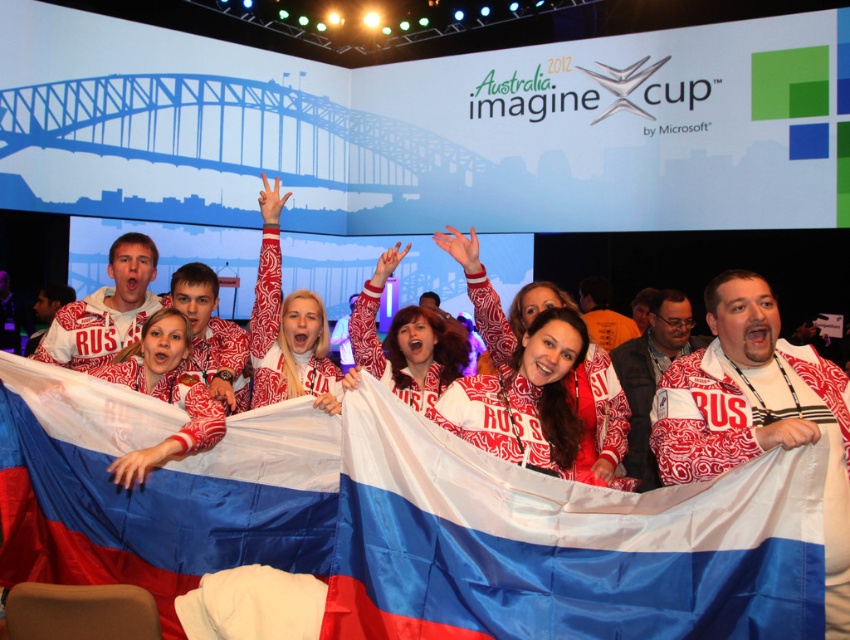
Question: Is russian flag at center to the left of white matte jacket at center from the viewer's perspective?

Choices:
 (A) yes
 (B) no

Answer: (A)

Question: Which point is farther from the camera taking this photo?

Choices:
 (A) (301, 385)
 (B) (145, 412)
 (C) (666, 541)
 (D) (794, 388)

Answer: (A)

Question: Is polyester flag at center below white textured jacket at center?

Choices:
 (A) no
 (B) yes

Answer: (B)

Question: Does white matte jacket at center appear on the right side of white printed sweater at center?

Choices:
 (A) yes
 (B) no

Answer: (A)

Question: Among these points, which one is farthest from the camera?

Choices:
 (A) (836, 522)
 (B) (816, 524)
 (C) (264, 244)
 (D) (112, 376)

Answer: (C)

Question: Which point is farther to the camera?

Choices:
 (A) white textured sweater at center
 (B) white matte jacket at center

Answer: (A)